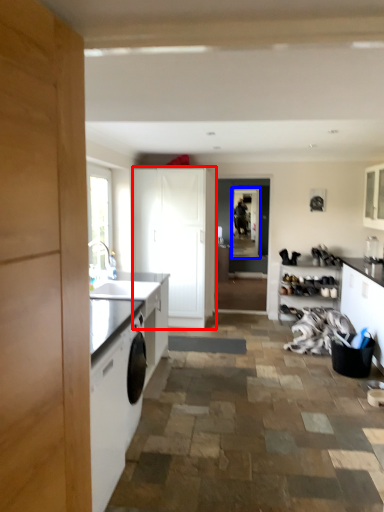
Question: Which object appears farthest to the camera in this image, cabinetry (highlighted by a red box) or screen door (highlighted by a blue box)?

Choices:
 (A) cabinetry
 (B) screen door

Answer: (B)